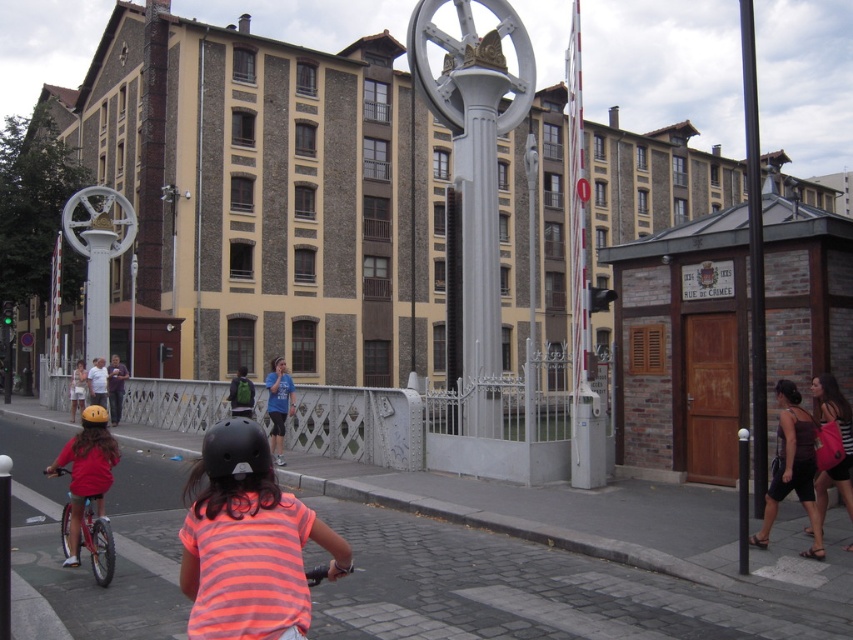
You are a delivery person who needs to secure a green backpack at center onto a silver metallic bicycle at left. Considering the spatial relationship between them, will the backpack fit comfortably on the bicycle?

The silver metallic bicycle at left has a lesser height compared to green backpack at center. This means the backpack may not fit comfortably on the bicycle due to its greater height, potentially causing instability or difficulty in securing it properly.

You are a photographer standing in the scene and want to capture both the orange striped shirt at center and the orange matte bicycle helmet at rear in a single frame. However, your camera has a limited depth of field. Which object should you focus on to ensure the other remains in focus?

You should focus on the orange striped shirt at center because it is closer to the camera than the orange matte bicycle helmet at rear. Since the orange striped shirt at center is smaller than the orange matte bicycle helmet at rear, it is likely nearer, so focusing on it would keep the helmet in focus as well due to the depth of field extending behind the point of focus.

You are a tourist in the city and see the silver metallic bicycle at left and the green backpack at center. Which object is closer to you?

The silver metallic bicycle at left is closer to you since it is positioned in front of the green backpack at center.